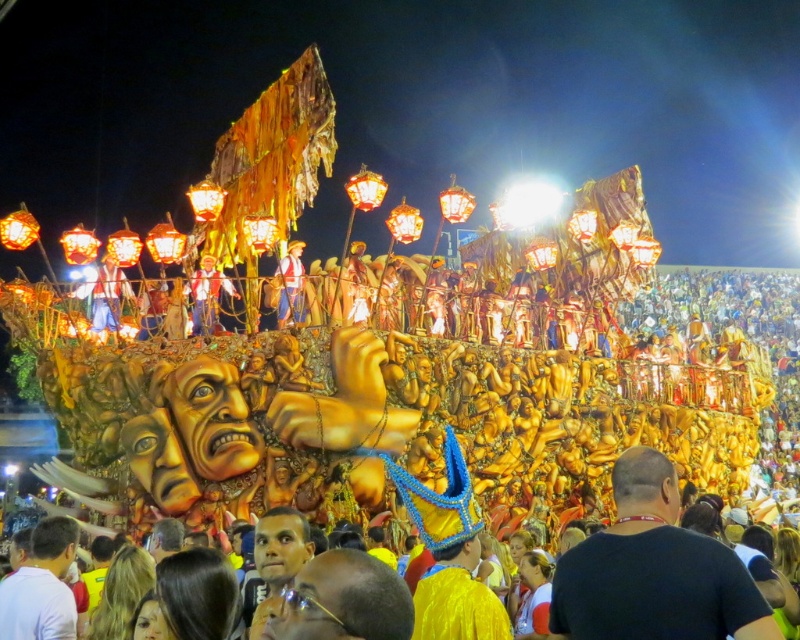
You are standing at the camera position and want to take a photo of the matte gold figure at upper center. Considering the distance, would you need a zoom lens to capture the entire figure in the frame?

The matte gold figure at upper center is 227.81 feet away from the camera. To capture the entire figure in the frame from that distance, you would likely need a zoom lens to ensure the subject fills the photo appropriately without appearing too small or cropped.

You are a photographer positioned in front of the carnival float. You want to take a photo that includes both the black matte shirt at center and the matte gold statue at center. Which object should you focus on first to ensure both are in frame?

The black matte shirt at center is in front of the matte gold statue at center, so you should focus on the matte gold statue at center first to ensure both are in frame.